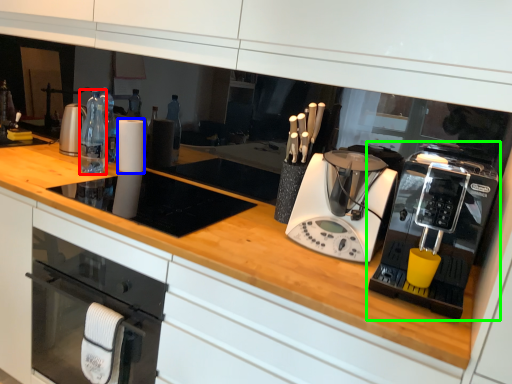
Question: Which object is positioned farthest from bottle (highlighted by a red box)? Select from paper towel (highlighted by a blue box) and home appliance (highlighted by a green box).

Choices:
 (A) paper towel
 (B) home appliance

Answer: (B)